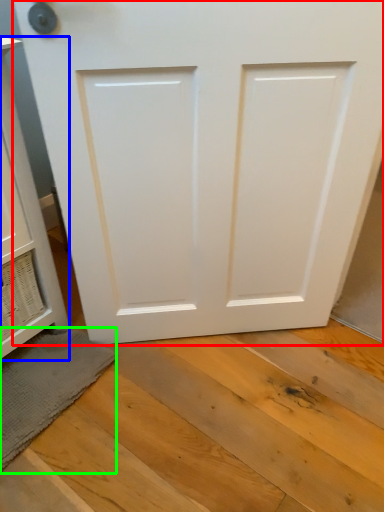
Question: Estimate the real-world distances between objects in this image. Which object is closer to door (highlighted by a red box), cabinetry (highlighted by a blue box) or bath mat (highlighted by a green box)?

Choices:
 (A) cabinetry
 (B) bath mat

Answer: (A)